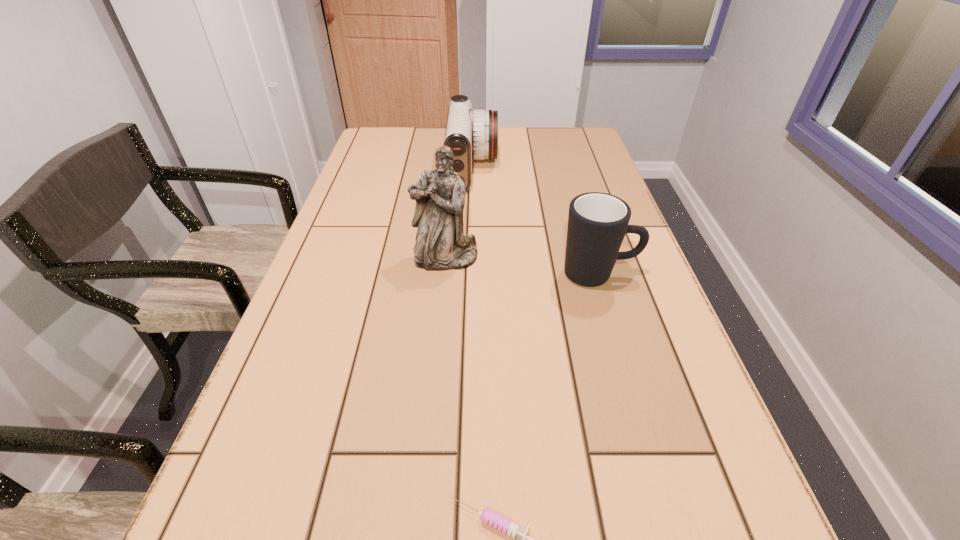
Identify the location of figurine. The image size is (960, 540). coord(441,245).

Identify the location of camcorder. (470, 134).

At what (x,y) coordinates should I click in order to perform the action: click on mug. Please return your answer as a coordinate pair (x, y). The height and width of the screenshot is (540, 960). Looking at the image, I should click on (597, 222).

The width and height of the screenshot is (960, 540). I want to click on free space located 0.210m on the front-facing side of the tallest object, so click(x=438, y=345).

Where is `blank space located 0.270m on the surface of the camcorder`? blank space located 0.270m on the surface of the camcorder is located at coordinates (586, 170).

At what (x,y) coordinates should I click in order to perform the action: click on object located at the far edge. Please return your answer as a coordinate pair (x, y). Looking at the image, I should click on (470, 134).

Where is `object positioned at the right edge`? object positioned at the right edge is located at coordinates click(597, 222).

Locate an element on the screen. This screenshot has height=540, width=960. vacant area at the far edge of the desktop is located at coordinates (530, 134).

What are the coordinates of `vacant space at the left edge of the desktop` in the screenshot? It's located at tap(338, 263).

You are a GUI agent. You are given a task and a screenshot of the screen. Output one action in this format:
    pyautogui.click(x=<x>, y=<y>)
    Task: Click on the vacant space at the right edge
    
    Given the screenshot: What is the action you would take?
    click(x=653, y=501)